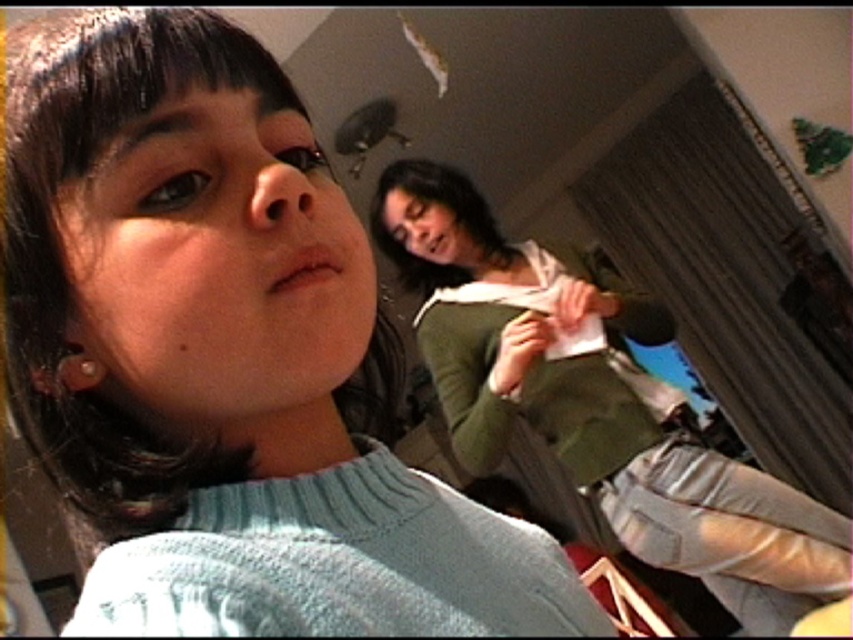
Question: Can you confirm if light blue sweater at upper left is positioned below green matte sweater at upper right?

Choices:
 (A) yes
 (B) no

Answer: (B)

Question: Among these points, which one is farthest from the camera?

Choices:
 (A) (154, 336)
 (B) (393, 182)

Answer: (B)

Question: Is light blue sweater at upper left to the right of green matte sweater at upper right from the viewer's perspective?

Choices:
 (A) no
 (B) yes

Answer: (A)

Question: Which object appears farthest from the camera in this image?

Choices:
 (A) green matte sweater at upper right
 (B) light blue sweater at upper left

Answer: (A)

Question: Considering the relative positions of light blue sweater at upper left and green matte sweater at upper right in the image provided, where is light blue sweater at upper left located with respect to green matte sweater at upper right?

Choices:
 (A) right
 (B) left

Answer: (B)